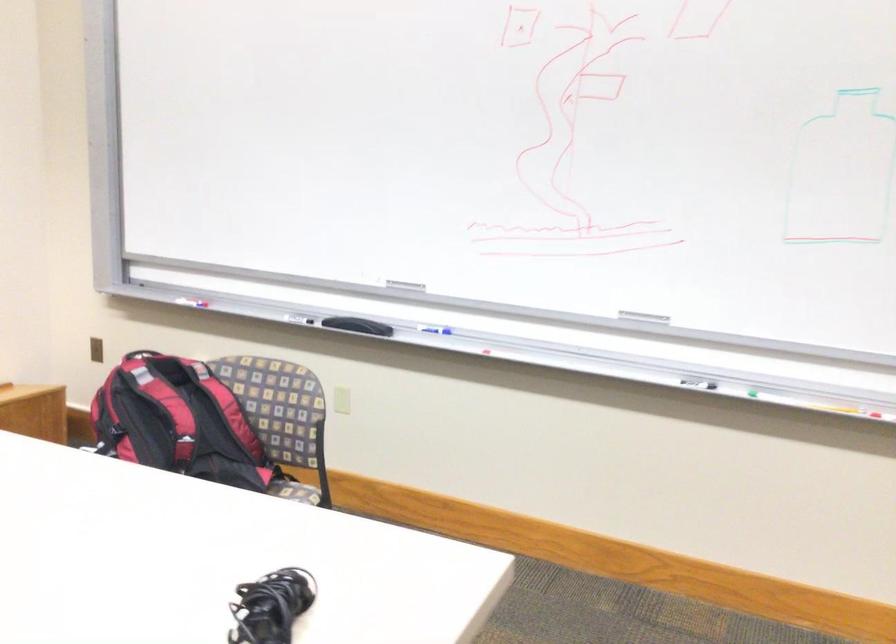
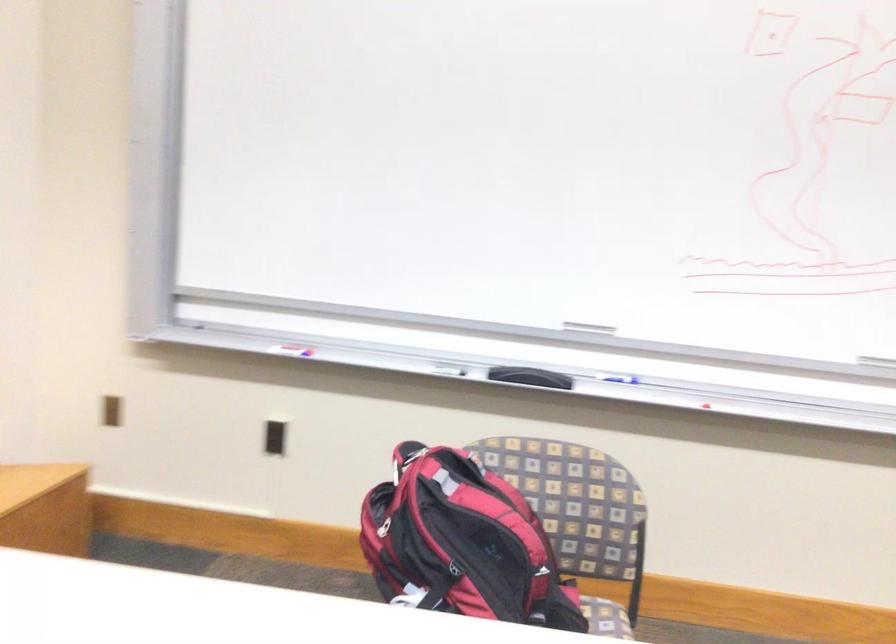
Where in the second image is the point corresponding to the point at 186,424 from the first image?

(478, 542)